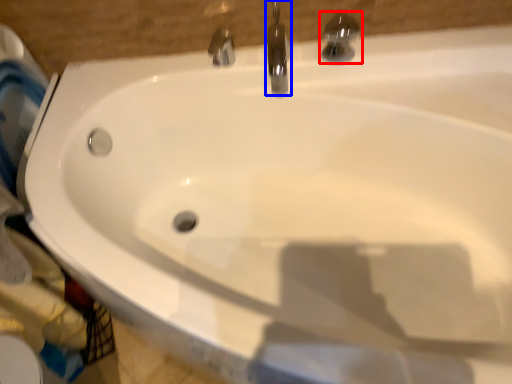
Question: Which object is further to the camera taking this photo, tap (highlighted by a red box) or tap (highlighted by a blue box)?

Choices:
 (A) tap
 (B) tap

Answer: (B)